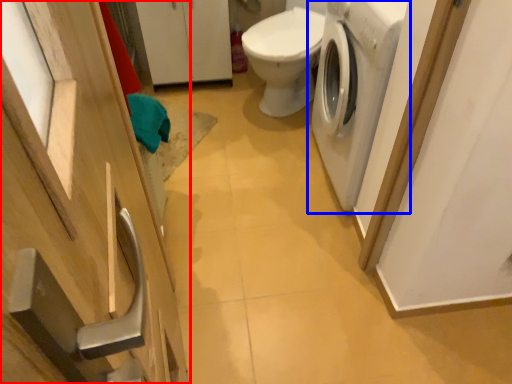
Question: Which object is further to the camera taking this photo, cabinetry (highlighted by a red box) or washing machine (highlighted by a blue box)?

Choices:
 (A) cabinetry
 (B) washing machine

Answer: (B)